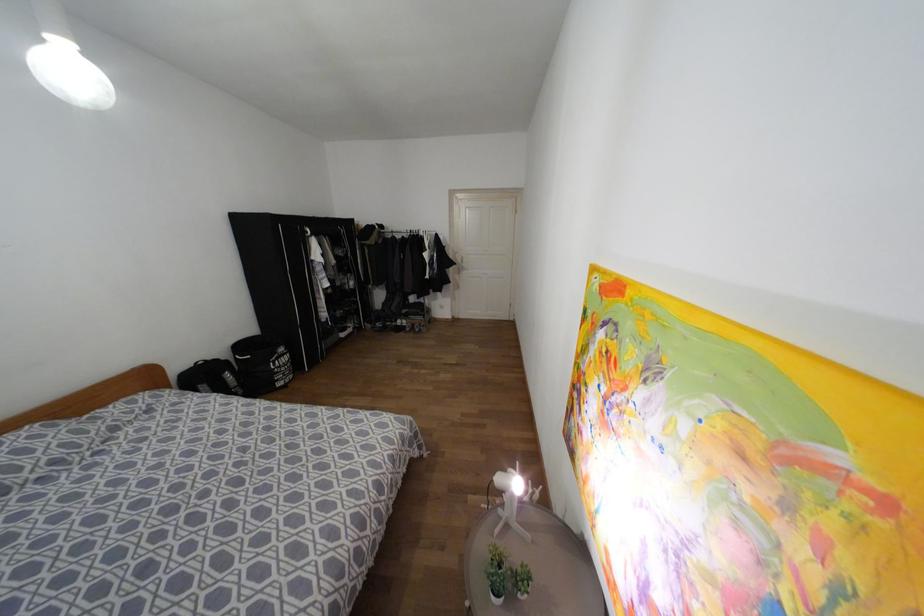
You are a GUI agent. You are given a task and a screenshot of the screen. Output one action in this format:
    pyautogui.click(x=<x>, y=<y>)
    Task: Click on the white door handle
    This screenshot has height=616, width=924.
    Given the screenshot: What is the action you would take?
    pyautogui.click(x=458, y=262)